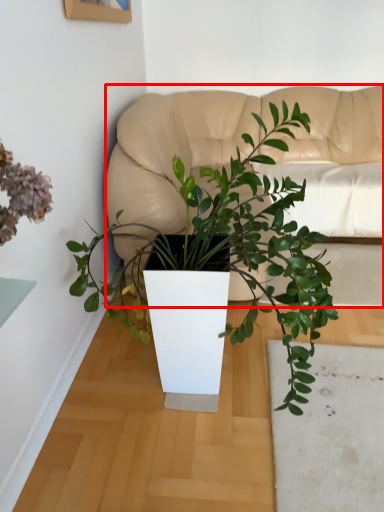
Question: Observing the image, what is the correct spatial positioning of couch (annotated by the red box) in reference to houseplant?

Choices:
 (A) left
 (B) right

Answer: (B)